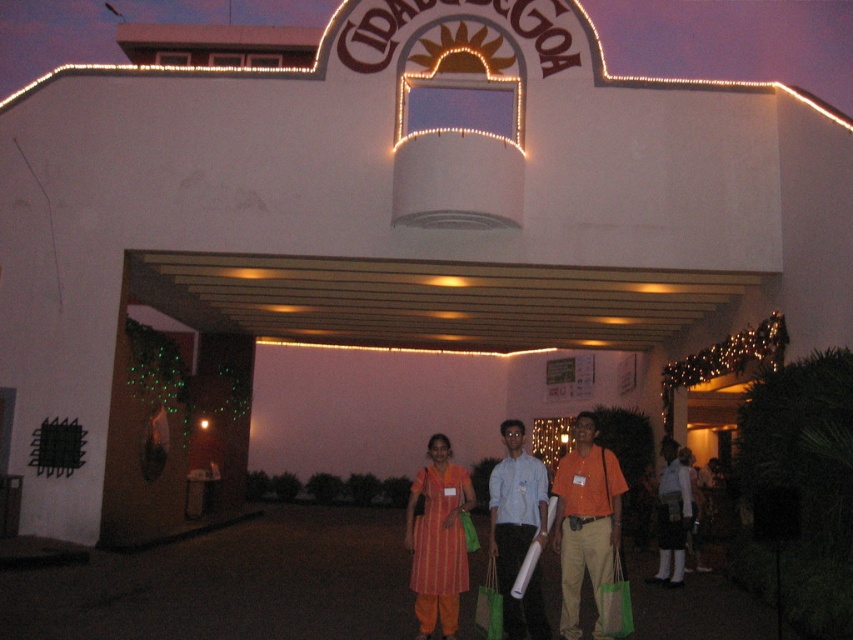
You are a photographer trying to capture a group photo of the people in front of the building. The orange striped dress at center and the green fabric bag at center are both in the frame. Which item takes up more space horizontally in the photo?

The orange striped dress at center takes up more space horizontally in the photo because its width is larger than the green fabric bag at center.

You are taking a photo of the group in front of the Cidade de Goa building. You notice an orange cotton shirt at center and a green mesh bag at center. Which object is positioned more to the left side of the photo?

The orange cotton shirt at center is positioned more to the left side of the photo than the green mesh bag at center.